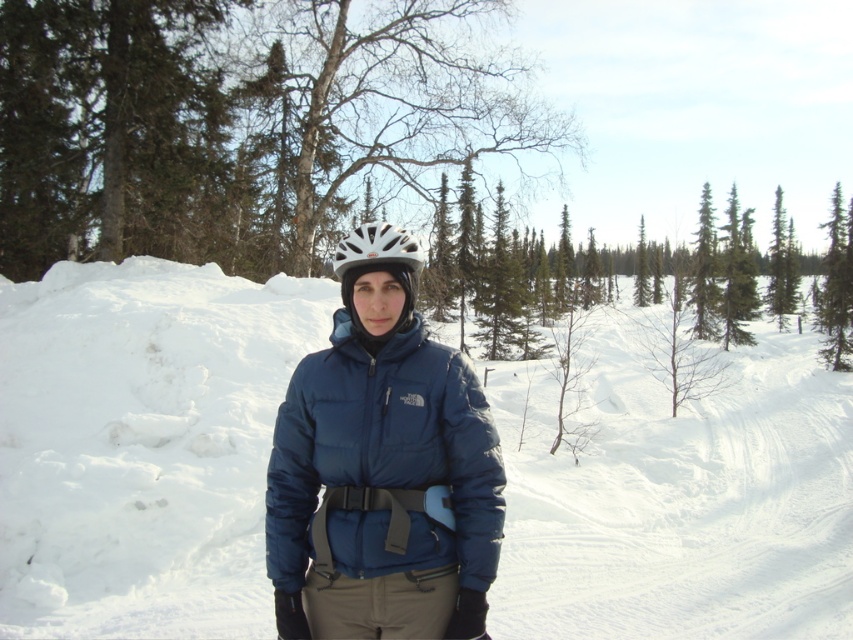
Question: Among these objects, which one is farthest from the camera?

Choices:
 (A) navy blue down jacket at center
 (B) white matte helmet at center

Answer: (B)

Question: Estimate the real-world distances between objects in this image. Which object is closer to the green textured pine tree at right?

Choices:
 (A) white matte bicycle helmet at center
 (B) matte blue jacket at center
 (C) white matte helmet at center
 (D) navy blue down jacket at center

Answer: (B)

Question: Estimate the real-world distances between objects in this image. Which object is closer to the white matte bicycle helmet at center?

Choices:
 (A) matte blue jacket at center
 (B) green textured pine tree at right
 (C) white matte helmet at center

Answer: (C)

Question: Does green textured pine tree at right have a lesser width compared to white matte helmet at center?

Choices:
 (A) no
 (B) yes

Answer: (A)

Question: Considering the relative positions of matte blue jacket at center and white matte helmet at center in the image provided, where is matte blue jacket at center located with respect to white matte helmet at center?

Choices:
 (A) below
 (B) above

Answer: (A)

Question: Does navy blue down jacket at center appear over green textured pine tree at right?

Choices:
 (A) no
 (B) yes

Answer: (A)